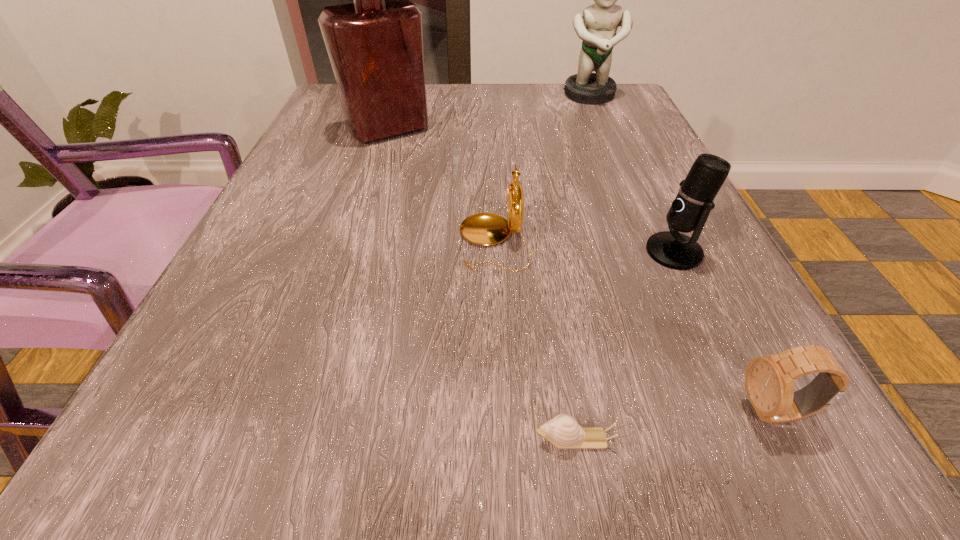
You are a GUI agent. You are given a task and a screenshot of the screen. Output one action in this format:
    pyautogui.click(x=<x>, y=<y>)
    Task: Click on the liquor that is at the far edge
    This screenshot has height=540, width=960.
    Given the screenshot: What is the action you would take?
    pyautogui.click(x=375, y=45)

In order to click on figurine at the far edge in this screenshot , I will do `click(597, 27)`.

Locate an element on the screen. The height and width of the screenshot is (540, 960). watch that is at the near edge is located at coordinates (769, 381).

Identify the location of escargot that is at the near edge. The height and width of the screenshot is (540, 960). (563, 431).

What are the coordinates of `object located at the left edge` in the screenshot? It's located at (375, 45).

Locate an element on the screen. The height and width of the screenshot is (540, 960). figurine that is at the right edge is located at coordinates coord(597,27).

Locate an element on the screen. The width and height of the screenshot is (960, 540). microphone at the right edge is located at coordinates (689, 211).

Find the location of `watch that is at the right edge`. watch that is at the right edge is located at coordinates (769, 381).

The image size is (960, 540). Identify the location of object present at the far left corner. coord(375,45).

This screenshot has height=540, width=960. I want to click on object that is at the far right corner, so click(x=597, y=27).